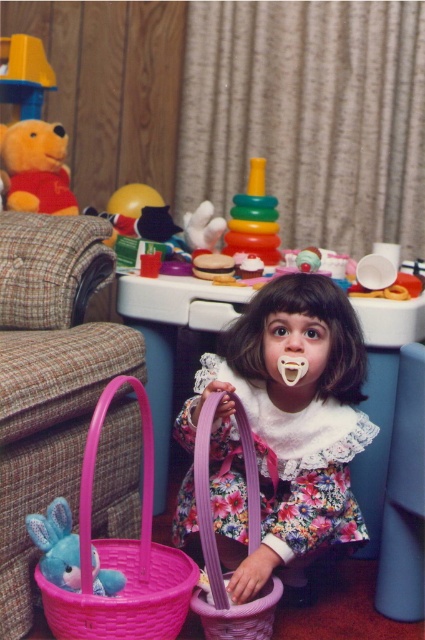
Question: Which of the following is the closest to the observer?

Choices:
 (A) (5, 372)
 (B) (227, 625)
 (C) (96, 586)

Answer: (C)

Question: Does pink wicker basket at lower left appear over purple woven basket at center?

Choices:
 (A) yes
 (B) no

Answer: (A)

Question: Which point is farther from the camera taking this photo?

Choices:
 (A) (342, 340)
 (B) (39, 205)
 (C) (204, 449)
 (D) (227, 410)

Answer: (B)

Question: Is brown plaid armchair at left to the right of soft plush bear at upper left from the viewer's perspective?

Choices:
 (A) yes
 (B) no

Answer: (A)

Question: Based on their relative distances, which object is farther from the soft plush bear at upper left?

Choices:
 (A) multicolored plastic stacking rings at center
 (B) plush blue rabbit at lower left

Answer: (B)

Question: Observing the image, what is the correct spatial positioning of pink wicker basket at lower left in reference to purple rubber teething ring at center?

Choices:
 (A) right
 (B) left

Answer: (B)